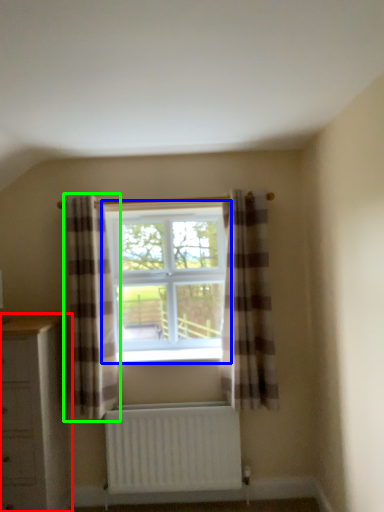
Question: Considering the real-world distances, which object is closest to chest of drawers (highlighted by a red box)? window (highlighted by a blue box) or curtain (highlighted by a green box).

Choices:
 (A) window
 (B) curtain

Answer: (B)